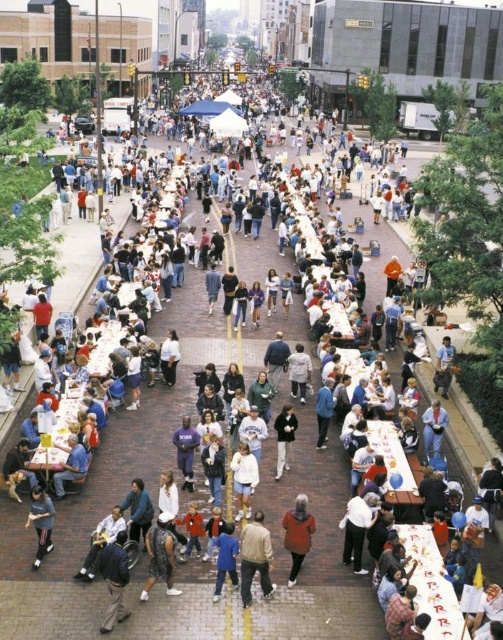
Who is more distant from viewer, (x=150, y=564) or (x=278, y=474)?

Positioned behind is point (x=278, y=474).

Who is higher up, patterned fabric dress at center or dark gray sweater at center?

dark gray sweater at center is above.

What do you see at coordinates (159, 556) in the screenshot?
I see `patterned fabric dress at center` at bounding box center [159, 556].

The height and width of the screenshot is (640, 503). What are the coordinates of `patterned fabric dress at center` in the screenshot? It's located at (159, 556).

Does white matte shorts at center appear under light gray fabric jacket at center?

Yes.

Identify the location of white matte shorts at center. (243, 477).

The height and width of the screenshot is (640, 503). What do you see at coordinates (243, 477) in the screenshot?
I see `white matte shorts at center` at bounding box center [243, 477].

I want to click on white matte shorts at center, so click(x=243, y=477).

Which is in front, point (36, 513) or point (288, 432)?

Point (36, 513) is in front.

Which is behind, point (52, 513) or point (279, 472)?

Point (279, 472)

Is point (32, 508) behind point (286, 438)?

No.

Identify the location of dark gray sweatshirt at lower left. (41, 522).